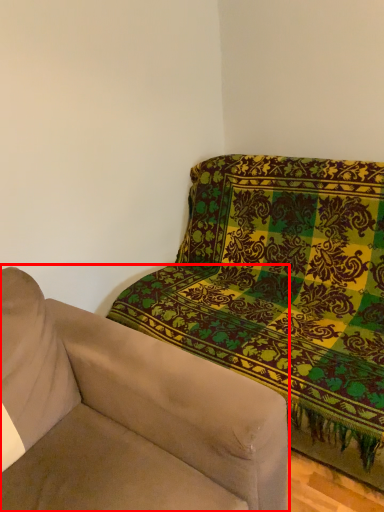
Question: From the image, what is the correct spatial relationship of studio couch (annotated by the red box) in relation to studio sofa?

Choices:
 (A) right
 (B) left

Answer: (B)